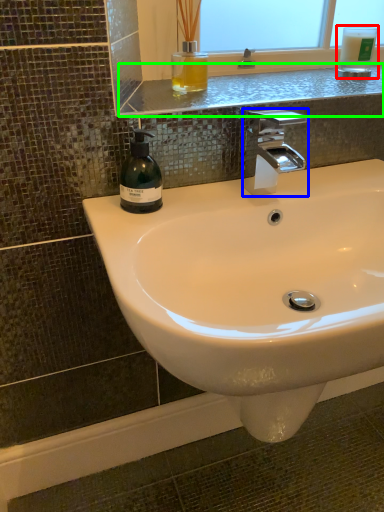
Question: Which is nearer to the mouthwash (highlighted by a red box)? tap (highlighted by a blue box) or window sill (highlighted by a green box).

Choices:
 (A) tap
 (B) window sill

Answer: (B)